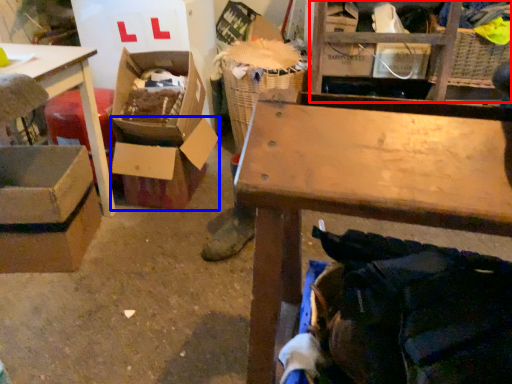
Question: Among these objects, which one is farthest to the camera, shelf (highlighted by a red box) or box (highlighted by a blue box)?

Choices:
 (A) shelf
 (B) box

Answer: (A)